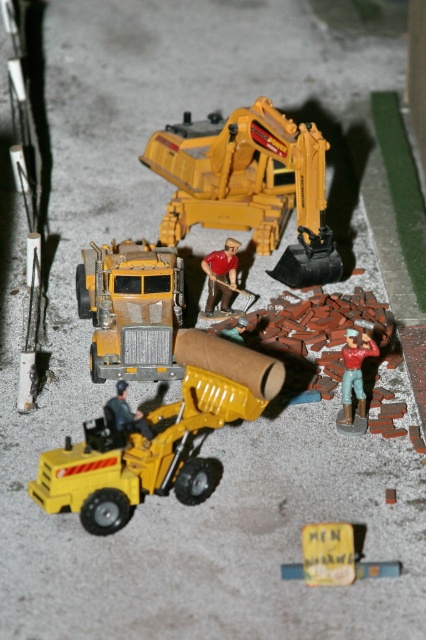
Question: Based on their relative distances, which object is nearer to the yellow plastic excavator at center?

Choices:
 (A) red shirt figure at center
 (B) yellow plastic sign at center
 (C) yellow rubber toy truck at center
 (D) metallic yellow construction worker at center

Answer: (A)

Question: Is yellow plastic excavator at center below matte yellow truck at center?

Choices:
 (A) no
 (B) yes

Answer: (A)

Question: Which of the following is the farthest from the observer?

Choices:
 (A) matte yellow truck at center
 (B) red shirt figure at center
 (C) yellow plastic sign at center

Answer: (B)

Question: Estimate the real-world distances between objects in this image. Which object is farther from the yellow plastic sign at center?

Choices:
 (A) metallic yellow construction worker at center
 (B) matte red construction worker at center right
 (C) red shirt figure at center
 (D) yellow plastic excavator at center

Answer: (D)

Question: Does yellow plastic excavator at center have a lesser width compared to red shirt figure at center?

Choices:
 (A) yes
 (B) no

Answer: (B)

Question: Does yellow rubber toy truck at center appear on the left side of yellow plastic sign at center?

Choices:
 (A) yes
 (B) no

Answer: (A)